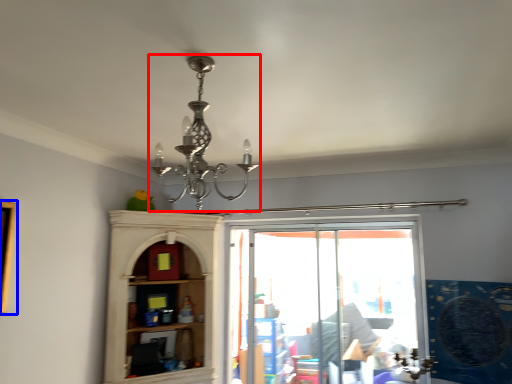
Question: Among these objects, which one is farthest to the camera, lamp (highlighted by a red box) or picture frame (highlighted by a blue box)?

Choices:
 (A) lamp
 (B) picture frame

Answer: (B)